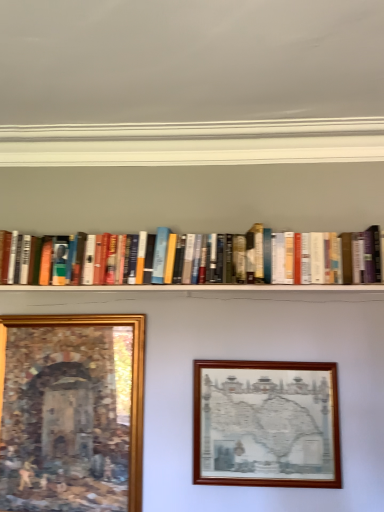
Question: Is the depth of hardcover books at center greater than that of wooden picture frame at center, the first picture frame from the right?

Choices:
 (A) no
 (B) yes

Answer: (B)

Question: Is hardcover books at center oriented towards wooden picture frame at center, the 2th picture frame positioned from the left?

Choices:
 (A) yes
 (B) no

Answer: (B)

Question: Is hardcover books at center taller than wooden picture frame at center, the 2th picture frame positioned from the left?

Choices:
 (A) no
 (B) yes

Answer: (A)

Question: Is hardcover books at center shorter than wooden picture frame at center, the 2th picture frame positioned from the left?

Choices:
 (A) yes
 (B) no

Answer: (A)

Question: Is hardcover books at center located outside wooden picture frame at center, the first picture frame from the right?

Choices:
 (A) no
 (B) yes

Answer: (B)

Question: Considering their positions, is hardcover books at center located in front of or behind wooden picture frame at center, the 2th picture frame positioned from the left?

Choices:
 (A) behind
 (B) front

Answer: (A)

Question: Considering the positions of hardcover books at center and wooden picture frame at center, the 2th picture frame positioned from the left, in the image, is hardcover books at center taller or shorter than wooden picture frame at center, the 2th picture frame positioned from the left,?

Choices:
 (A) short
 (B) tall

Answer: (A)

Question: From a real-world perspective, is hardcover books at center positioned above or below wooden picture frame at center, the first picture frame from the right?

Choices:
 (A) below
 (B) above

Answer: (B)

Question: In terms of size, does hardcover books at center appear bigger or smaller than wooden picture frame at center, the 2th picture frame positioned from the left?

Choices:
 (A) small
 (B) big

Answer: (B)

Question: Looking at the image, does gold-framed painting at lower left, which is the second picture frame in right-to-left order, seem bigger or smaller compared to hardcover books at center?

Choices:
 (A) big
 (B) small

Answer: (B)

Question: Considering the positions of point (87, 387) and point (273, 279), is point (87, 387) closer or farther from the camera than point (273, 279)?

Choices:
 (A) closer
 (B) farther

Answer: (B)

Question: In terms of height, does gold-framed painting at lower left, the 1th picture frame viewed from the left, look taller or shorter compared to hardcover books at center?

Choices:
 (A) short
 (B) tall

Answer: (B)

Question: Choose the correct answer: Is gold-framed painting at lower left, which is the second picture frame in right-to-left order, inside hardcover books at center or outside it?

Choices:
 (A) outside
 (B) inside

Answer: (A)

Question: From their relative heights in the image, would you say hardcover books at center is taller or shorter than gold-framed painting at lower left, which is the second picture frame in right-to-left order?

Choices:
 (A) tall
 (B) short

Answer: (B)

Question: From a real-world perspective, is hardcover books at center above or below gold-framed painting at lower left, which is the second picture frame in right-to-left order?

Choices:
 (A) below
 (B) above

Answer: (B)